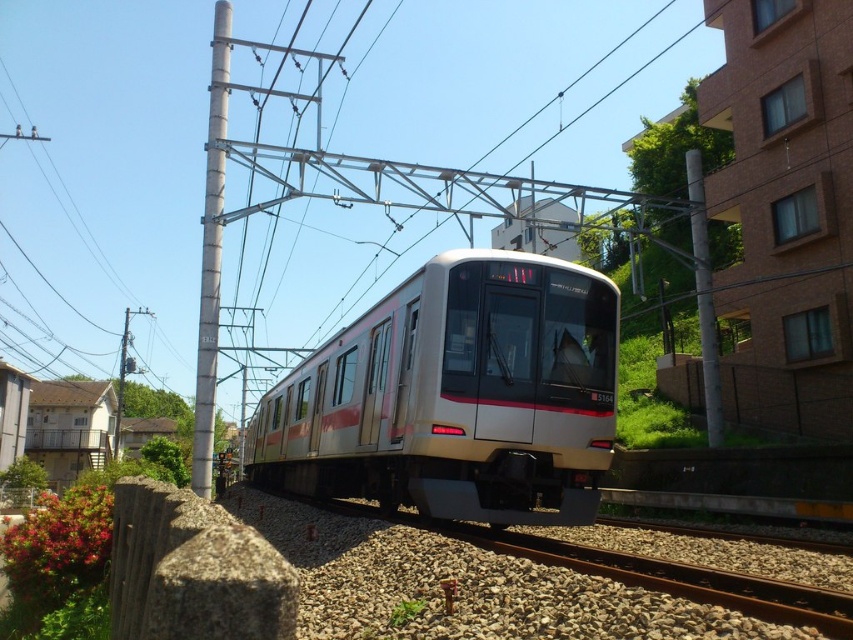
Does silver metallic train at center come behind metallic gray pole at upper center?

No, silver metallic train at center is in front of metallic gray pole at upper center.

This screenshot has width=853, height=640. I want to click on silver metallic train at center, so click(x=456, y=396).

The width and height of the screenshot is (853, 640). I want to click on silver metallic train at center, so click(456, 396).

Can you confirm if metallic gray pole at left is positioned to the left of metallic gray pole at upper center?

Indeed, metallic gray pole at left is positioned on the left side of metallic gray pole at upper center.

Looking at this image, who is taller, metallic gray pole at left or metallic gray pole at upper center?

Standing taller between the two is metallic gray pole at left.

Measure the distance between point [194,401] and camera.

Point [194,401] is 370.05 feet from camera.

Find the location of a particular element. The width and height of the screenshot is (853, 640). metallic gray pole at left is located at coordinates (212, 252).

Which is behind, point (357, 449) or point (206, 252)?

Positioned behind is point (206, 252).

Between silver metallic train at center and metallic gray pole at left, which one has less height?

silver metallic train at center is shorter.

I want to click on silver metallic train at center, so click(x=456, y=396).

Find the location of a particular element. silver metallic train at center is located at coordinates (456, 396).